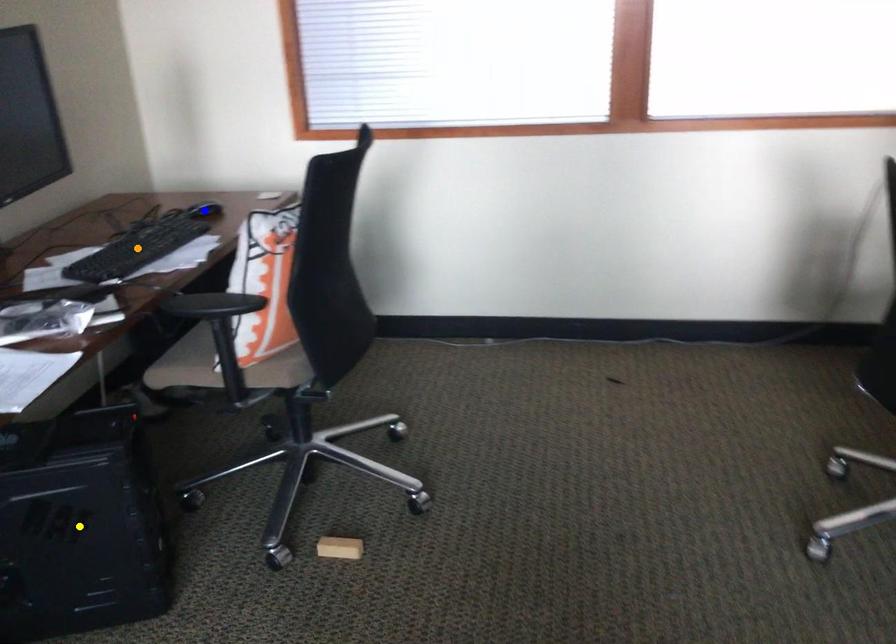
Order these from nearest to farthest:
A) orange point
B) yellow point
C) blue point

yellow point < orange point < blue point